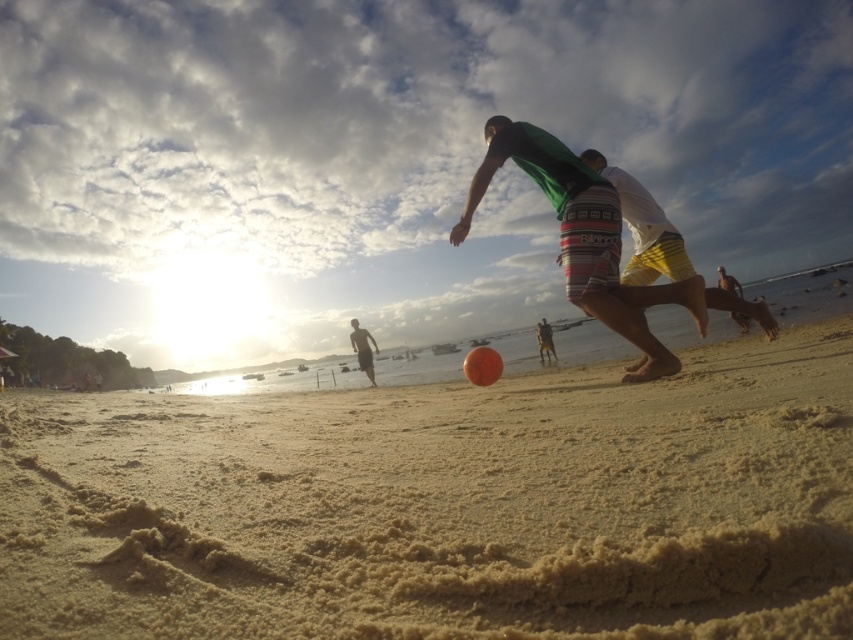
Is sandy yellow at center further to the viewer compared to green fabric shirt at center?

That is False.

This screenshot has width=853, height=640. What do you see at coordinates (444, 506) in the screenshot?
I see `sandy yellow at center` at bounding box center [444, 506].

You are a GUI agent. You are given a task and a screenshot of the screen. Output one action in this format:
    pyautogui.click(x=<x>, y=<y>)
    Task: Click on the sandy yellow at center
    
    Given the screenshot: What is the action you would take?
    pyautogui.click(x=444, y=506)

Describe the element at coordinates (585, 240) in the screenshot. I see `green striped shorts at center` at that location.

Find the location of a particular element. green striped shorts at center is located at coordinates [585, 240].

Does point (614, 230) lie in front of point (358, 353)?

Yes, point (614, 230) is in front of point (358, 353).

Locate an element on the screen. The image size is (853, 640). green striped shorts at center is located at coordinates (585, 240).

Does sandy yellow at center appear over green striped shorts at center?

No.

Which is in front, point (727, 502) or point (624, 292)?

Point (727, 502) is in front.

Find the location of a particular element. This screenshot has height=640, width=853. sandy yellow at center is located at coordinates (444, 506).